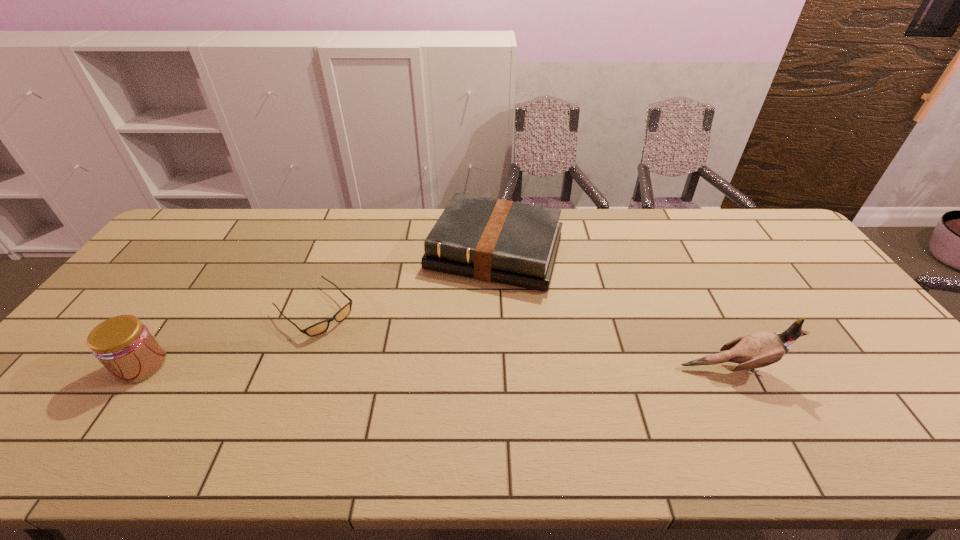
I want to click on the second tallest object, so click(126, 348).

I want to click on the leftmost object, so click(126, 348).

The image size is (960, 540). What are the coordinates of `the rightmost object` in the screenshot? It's located at (758, 350).

Identify the location of bird. Image resolution: width=960 pixels, height=540 pixels. (758, 350).

Find the location of a particular element. Image resolution: width=960 pixels, height=540 pixels. the second object from left to right is located at coordinates (320, 327).

Where is `sunglasses`? The image size is (960, 540). sunglasses is located at coordinates (320, 327).

The width and height of the screenshot is (960, 540). In order to click on hardback book in this screenshot , I will do `click(494, 240)`.

Where is `the third tallest object`? the third tallest object is located at coordinates (494, 240).

Locate an element on the screen. The height and width of the screenshot is (540, 960). blank space located 0.120m on the back of the third shortest object is located at coordinates (x=178, y=313).

Where is `vacant area located 0.200m at the face of the tallest object`? vacant area located 0.200m at the face of the tallest object is located at coordinates (863, 368).